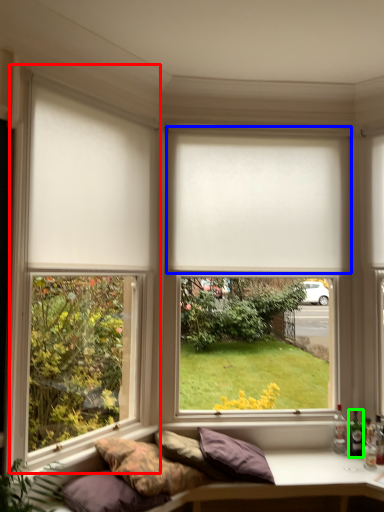
Question: Estimate the real-world distances between objects in this image. Which object is closer to window frame (highlighted by a red box), window blind (highlighted by a blue box) or bottle (highlighted by a green box)?

Choices:
 (A) window blind
 (B) bottle

Answer: (A)